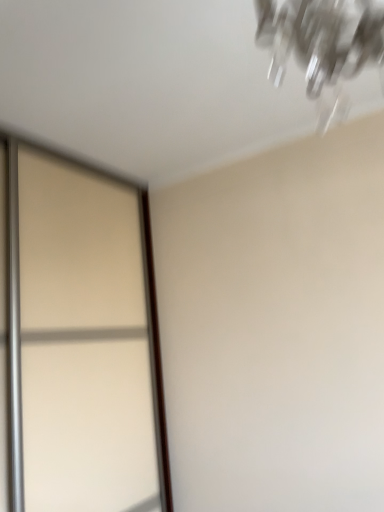
What is the approximate height of translucent glass screen door at left?

6.56 feet.

Find the location of a particular element. The width and height of the screenshot is (384, 512). translucent glass screen door at left is located at coordinates (79, 340).

The height and width of the screenshot is (512, 384). What do you see at coordinates (79, 340) in the screenshot?
I see `translucent glass screen door at left` at bounding box center [79, 340].

The height and width of the screenshot is (512, 384). Identify the location of clear glass chandelier at upper right. (322, 45).

What do you see at coordinates (322, 45) in the screenshot?
I see `clear glass chandelier at upper right` at bounding box center [322, 45].

At what (x,y) coordinates should I click in order to perform the action: click on translucent glass screen door at left. Please return your answer as a coordinate pair (x, y). This screenshot has width=384, height=512. Looking at the image, I should click on (79, 340).

Which object is positioned more to the left, translucent glass screen door at left or clear glass chandelier at upper right?

translucent glass screen door at left.

Considering the positions of objects translucent glass screen door at left and clear glass chandelier at upper right in the image provided, who is in front, translucent glass screen door at left or clear glass chandelier at upper right?

Positioned in front is clear glass chandelier at upper right.

Between point (66, 449) and point (342, 61), which one is positioned in front?

The point (342, 61) is closer to the camera.

From the image's perspective, is translucent glass screen door at left above or below clear glass chandelier at upper right?

translucent glass screen door at left is below clear glass chandelier at upper right.

From a real-world perspective, which object stands above the other?

In real-world perspective, clear glass chandelier at upper right is above.

In terms of width, does translucent glass screen door at left look wider or thinner when compared to clear glass chandelier at upper right?

In the image, translucent glass screen door at left appears to be wider than clear glass chandelier at upper right.

Which of these two, translucent glass screen door at left or clear glass chandelier at upper right, stands taller?

Standing taller between the two is translucent glass screen door at left.

Based on the photo, in terms of size, does translucent glass screen door at left appear bigger or smaller than clear glass chandelier at upper right?

Clearly, translucent glass screen door at left is larger in size than clear glass chandelier at upper right.

Can clear glass chandelier at upper right be found inside translucent glass screen door at left?

No, clear glass chandelier at upper right is not inside translucent glass screen door at left.

Is the surface of translucent glass screen door at left in direct contact with clear glass chandelier at upper right?

No, translucent glass screen door at left is not beside clear glass chandelier at upper right.

Is translucent glass screen door at left aimed at clear glass chandelier at upper right?

Yes, translucent glass screen door at left is oriented towards clear glass chandelier at upper right.

What's the angular difference between translucent glass screen door at left and clear glass chandelier at upper right's facing directions?

They differ by 90.7 degrees in their facing directions.

Find the location of a particular element. The height and width of the screenshot is (512, 384). screen door behind the clear glass chandelier at upper right is located at coordinates (79, 340).

Considering the relative positions of clear glass chandelier at upper right and translucent glass screen door at left in the image provided, is clear glass chandelier at upper right to the right of translucent glass screen door at left from the viewer's perspective?

Yes, clear glass chandelier at upper right is to the right of translucent glass screen door at left.

Is clear glass chandelier at upper right further to the viewer compared to translucent glass screen door at left?

No, it is in front of translucent glass screen door at left.

Which point is more distant from viewer, (377,20) or (122,306)?

Point (122,306)

Looking at this image, from the image's perspective, is clear glass chandelier at upper right above or below translucent glass screen door at left?

Based on their image positions, clear glass chandelier at upper right is located above translucent glass screen door at left.

From a real-world perspective, is clear glass chandelier at upper right physically below translucent glass screen door at left?

Incorrect, from a real-world perspective, clear glass chandelier at upper right is higher than translucent glass screen door at left.

Which object is wider, clear glass chandelier at upper right or translucent glass screen door at left?

translucent glass screen door at left.

Considering the relative sizes of clear glass chandelier at upper right and translucent glass screen door at left in the image provided, is clear glass chandelier at upper right taller than translucent glass screen door at left?

In fact, clear glass chandelier at upper right may be shorter than translucent glass screen door at left.

Is clear glass chandelier at upper right smaller than translucent glass screen door at left?

Correct, clear glass chandelier at upper right occupies less space than translucent glass screen door at left.

Consider the image. Choose the correct answer: Is clear glass chandelier at upper right inside translucent glass screen door at left or outside it?

clear glass chandelier at upper right cannot be found inside translucent glass screen door at left.

Is clear glass chandelier at upper right touching translucent glass screen door at left?

No, clear glass chandelier at upper right is not beside translucent glass screen door at left.

Is clear glass chandelier at upper right looking in the opposite direction of translucent glass screen door at left?

No, clear glass chandelier at upper right's orientation is not away from translucent glass screen door at left.

Based on the photo, how many degrees apart are the facing directions of clear glass chandelier at upper right and translucent glass screen door at left?

90.7 degrees separate the facing orientations of clear glass chandelier at upper right and translucent glass screen door at left.

The height and width of the screenshot is (512, 384). Identify the location of lamp above the translucent glass screen door at left (from a real-world perspective). (322, 45).

This screenshot has width=384, height=512. Identify the location of lamp in front of the translucent glass screen door at left. (322, 45).

The height and width of the screenshot is (512, 384). Find the location of `lamp above the translucent glass screen door at left (from a real-world perspective)`. lamp above the translucent glass screen door at left (from a real-world perspective) is located at coordinates (322, 45).